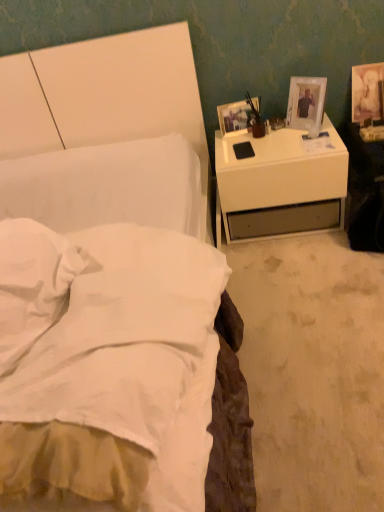
Question: Can you confirm if matte gold picture frame at upper right, arranged as the third picture frame when viewed from the left, is wider than white soft pillow at lower left?

Choices:
 (A) yes
 (B) no

Answer: (B)

Question: Is matte gold picture frame at upper right, the first picture frame when ordered from right to left, bigger than white soft pillow at lower left?

Choices:
 (A) no
 (B) yes

Answer: (A)

Question: Does matte gold picture frame at upper right, arranged as the third picture frame when viewed from the left, touch white soft pillow at lower left?

Choices:
 (A) yes
 (B) no

Answer: (B)

Question: Can you confirm if matte gold picture frame at upper right, the first picture frame when ordered from right to left, is positioned to the left of white soft pillow at lower left?

Choices:
 (A) yes
 (B) no

Answer: (B)

Question: Is matte gold picture frame at upper right, arranged as the third picture frame when viewed from the left, facing away from white soft pillow at lower left?

Choices:
 (A) no
 (B) yes

Answer: (A)

Question: From the image's perspective, would you say matte gold picture frame at upper right, arranged as the third picture frame when viewed from the left, is shown under white soft pillow at lower left?

Choices:
 (A) no
 (B) yes

Answer: (A)

Question: Is white soft pillow at lower left shorter than white soft bed at left?

Choices:
 (A) yes
 (B) no

Answer: (A)

Question: Is white soft pillow at lower left further to camera compared to white soft bed at left?

Choices:
 (A) yes
 (B) no

Answer: (A)

Question: From the image's perspective, is white soft pillow at lower left over white soft bed at left?

Choices:
 (A) no
 (B) yes

Answer: (A)

Question: Is white soft pillow at lower left thinner than white soft bed at left?

Choices:
 (A) yes
 (B) no

Answer: (A)

Question: Is white soft pillow at lower left bigger than white soft bed at left?

Choices:
 (A) no
 (B) yes

Answer: (A)

Question: From a real-world perspective, is white soft pillow at lower left below white soft bed at left?

Choices:
 (A) yes
 (B) no

Answer: (B)

Question: Can we say white glossy nightstand at right lies outside matte white picture frame at upper right, the 1th picture frame positioned from the left?

Choices:
 (A) no
 (B) yes

Answer: (B)